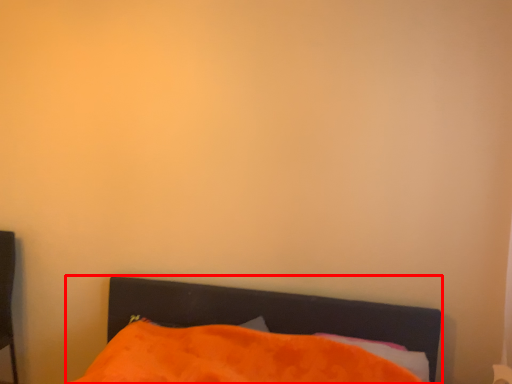
Question: Where is bed (annotated by the red box) located in relation to pillow in the image?

Choices:
 (A) left
 (B) right

Answer: (A)